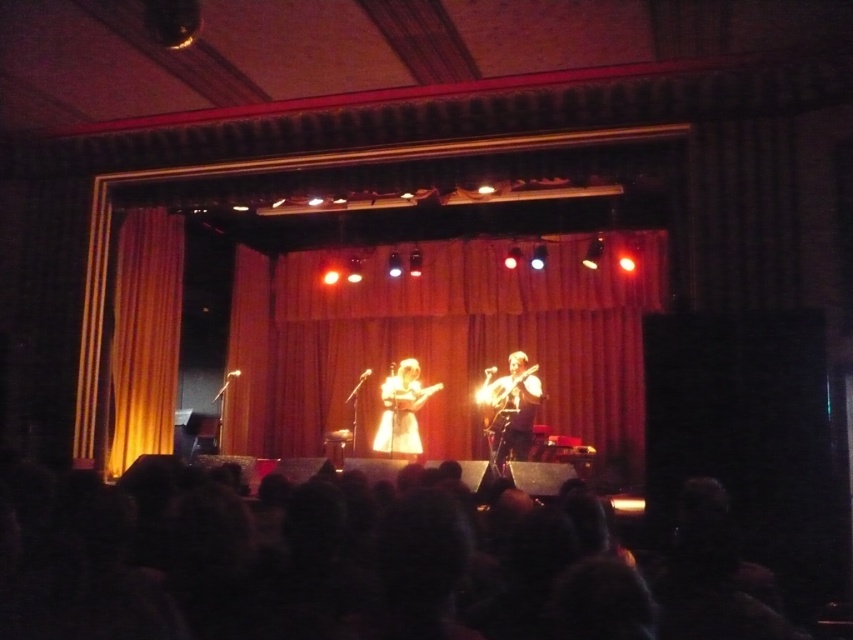
Question: Can you confirm if black hair at lower center is positioned to the right of shiny black guitar at center?

Choices:
 (A) no
 (B) yes

Answer: (A)

Question: In this image, where is black hair at lower center located relative to orange velvet curtain at left?

Choices:
 (A) below
 (B) above

Answer: (A)

Question: Does velvet drapes at center have a lesser width compared to orange velvet curtain at left?

Choices:
 (A) yes
 (B) no

Answer: (B)

Question: Which point is farther from the camera taking this photo?

Choices:
 (A) (631, 337)
 (B) (141, 307)

Answer: (A)

Question: Which object is positioned closest to the velvet drapes at center?

Choices:
 (A) wooden acoustic guitar at center
 (B) white fabric dress at center
 (C) orange velvet curtain at left
 (D) black hair at lower center

Answer: (B)

Question: Considering the real-world distances, which object is closest to the wooden acoustic guitar at center?

Choices:
 (A) white fabric dress at center
 (B) black hair at lower center
 (C) shiny black guitar at center

Answer: (A)